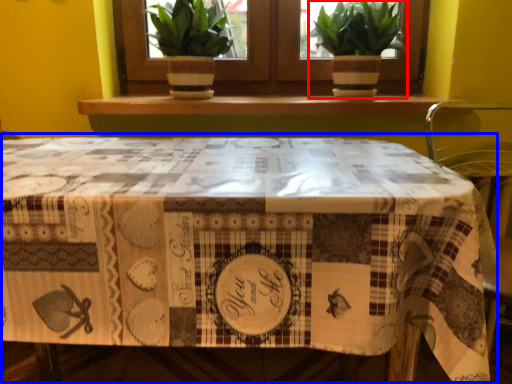
Question: Which object appears farthest to the camera in this image, houseplant (highlighted by a red box) or table (highlighted by a blue box)?

Choices:
 (A) houseplant
 (B) table

Answer: (A)